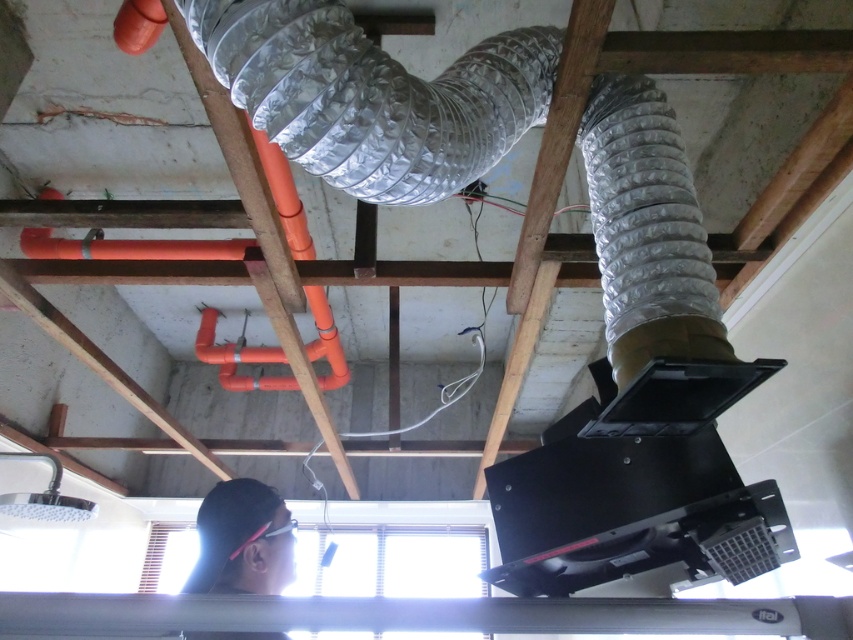
Question: In this image, where is silver metallic duct at upper center located relative to black matte hair at lower left?

Choices:
 (A) left
 (B) right

Answer: (B)

Question: Observing the image, what is the correct spatial positioning of silver metallic duct at upper center in reference to black matte hair at lower left?

Choices:
 (A) right
 (B) left

Answer: (A)

Question: Which of the following is the farthest from the observer?

Choices:
 (A) (288, 570)
 (B) (630, 332)

Answer: (A)

Question: Which point appears closest to the camera in this image?

Choices:
 (A) (279, 104)
 (B) (265, 634)

Answer: (A)

Question: Which object is farther from the camera taking this photo?

Choices:
 (A) black matte hair at lower left
 (B) silver metallic duct at upper center

Answer: (A)

Question: Where is silver metallic duct at upper center located in relation to black matte hair at lower left in the image?

Choices:
 (A) above
 (B) below

Answer: (A)